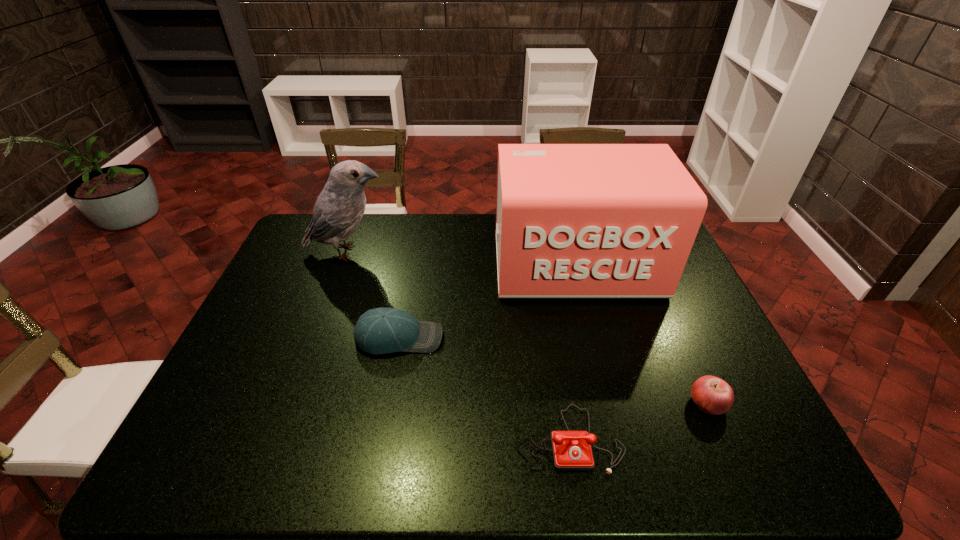
I want to click on parrot at the far edge, so click(x=339, y=208).

At what (x,y) coordinates should I click in order to perform the action: click on object situated at the near edge. Please return your answer as a coordinate pair (x, y). Looking at the image, I should click on (571, 450).

Locate an element on the screen. This screenshot has width=960, height=540. object located at the left edge is located at coordinates (339, 208).

Where is `box that is positioned at the right edge`? box that is positioned at the right edge is located at coordinates (572, 220).

Where is `apple that is positioned at the right edge`? This screenshot has height=540, width=960. apple that is positioned at the right edge is located at coordinates (712, 395).

Where is `object present at the far left corner`? object present at the far left corner is located at coordinates (339, 208).

Find the location of `object present at the far right corner`. object present at the far right corner is located at coordinates (572, 220).

Where is `free location at the far edge of the desktop`? free location at the far edge of the desktop is located at coordinates (471, 236).

In the image, there is a desktop. Find the location of `free space at the near edge`. free space at the near edge is located at coordinates (650, 452).

In the image, there is a desktop. At what (x,y) coordinates should I click in order to perform the action: click on free space at the left edge. Please return your answer as a coordinate pair (x, y). This screenshot has width=960, height=540. Looking at the image, I should click on (204, 414).